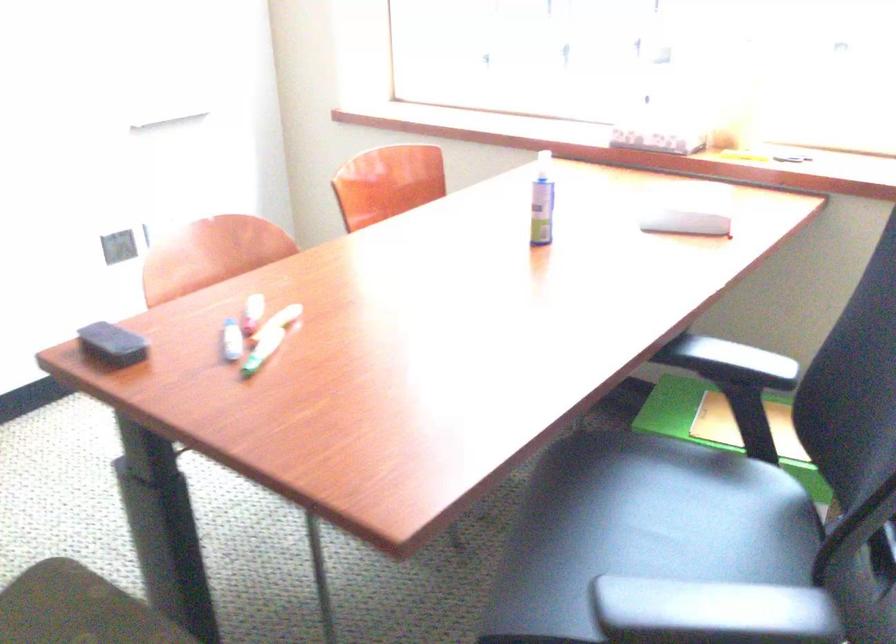
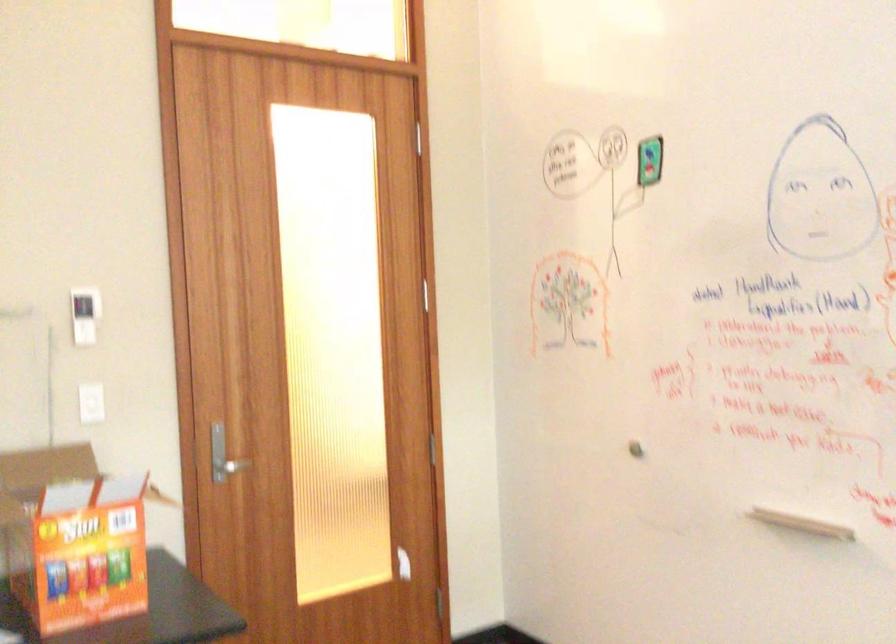
Question: The camera is either moving clockwise (left) or counter-clockwise (right) around the object. The first image is from the beginning of the video and the second image is from the end. Is the camera moving left or right when shooting the video?

Choices:
 (A) Left
 (B) Right

Answer: (B)